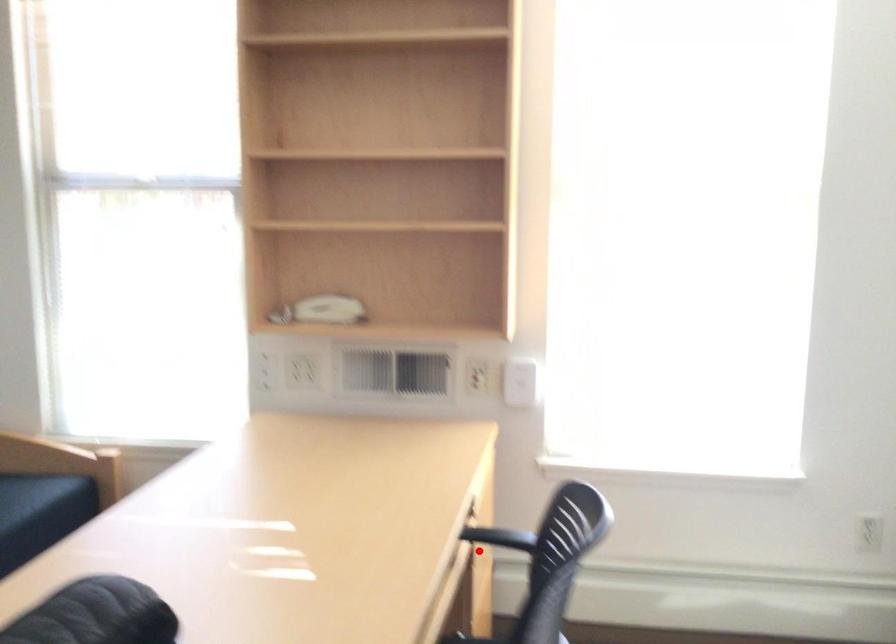
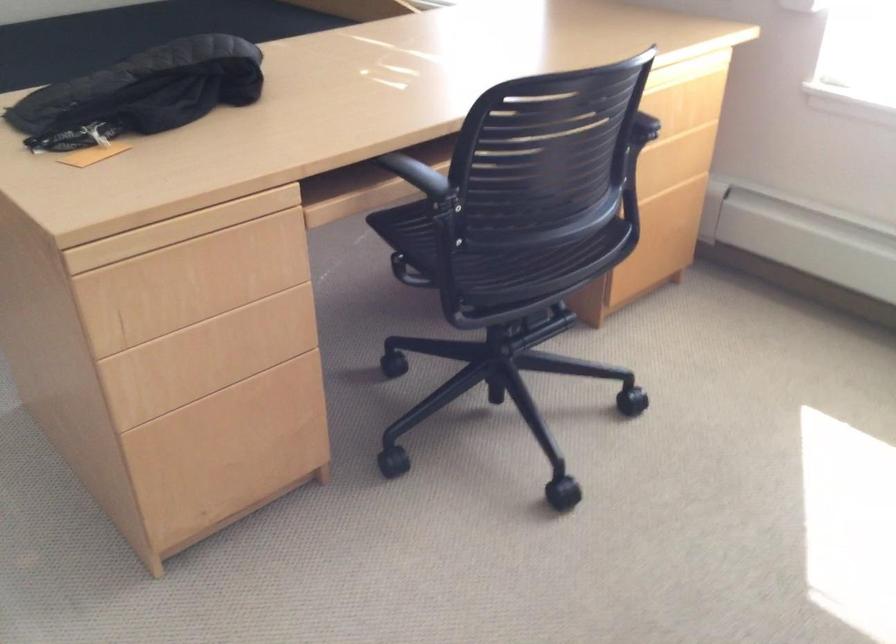
Question: I am providing you with two images of the same scene from different viewpoints. A red point is marked on the first image. Can you still see the location of the red point in image 2?

Choices:
 (A) Yes
 (B) No

Answer: (A)